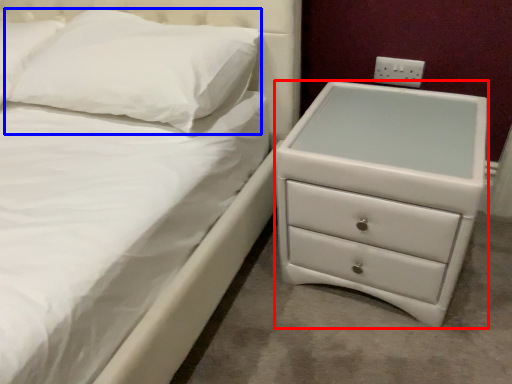
Question: Which object is further to the camera taking this photo, chest of drawers (highlighted by a red box) or pillow (highlighted by a blue box)?

Choices:
 (A) chest of drawers
 (B) pillow

Answer: (B)